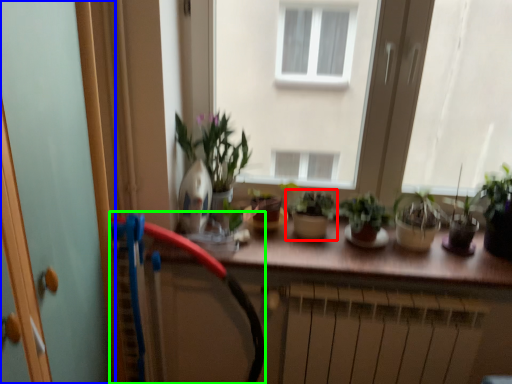
Question: Which object is the closest to the houseplant (highlighted by a red box)? Choose among these: screen door (highlighted by a blue box) or garden hose (highlighted by a green box).

Choices:
 (A) screen door
 (B) garden hose

Answer: (B)